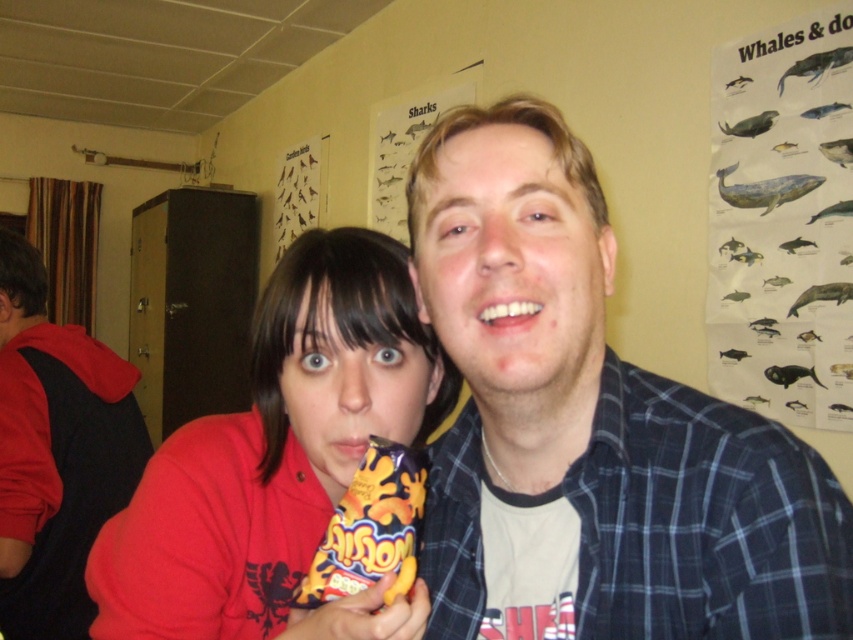
You are a photographer trying to capture both the red fleece sweatshirt at left and the yellow matte bag of crisps at center in a single frame. Which object should you focus on first to ensure both are in the frame?

The red fleece sweatshirt at left has a greater height compared to the yellow matte bag of crisps at center, so you should focus on the red fleece sweatshirt at left first to ensure both are in the frame.

You are organizing a party and need to place the blue plaid shirt at center and the matte plastic bag of chips at center on a shelf. If the shelf has limited space, which item should you place first to ensure both fit?

The blue plaid shirt at center has a smaller size compared to the matte plastic bag of chips at center, so you should place the matte plastic bag of chips at center first to accommodate its larger size, then the blue plaid shirt at center will fit alongside.

You are trying to decide which item to place in a narrow shelf space. Based on their sizes, which object would you choose between the red fleece sweatshirt at left and the yellow matte bag of crisps at center?

The yellow matte bag of crisps at center is smaller in width than the red fleece sweatshirt at left, so it would fit better in the narrow shelf space.